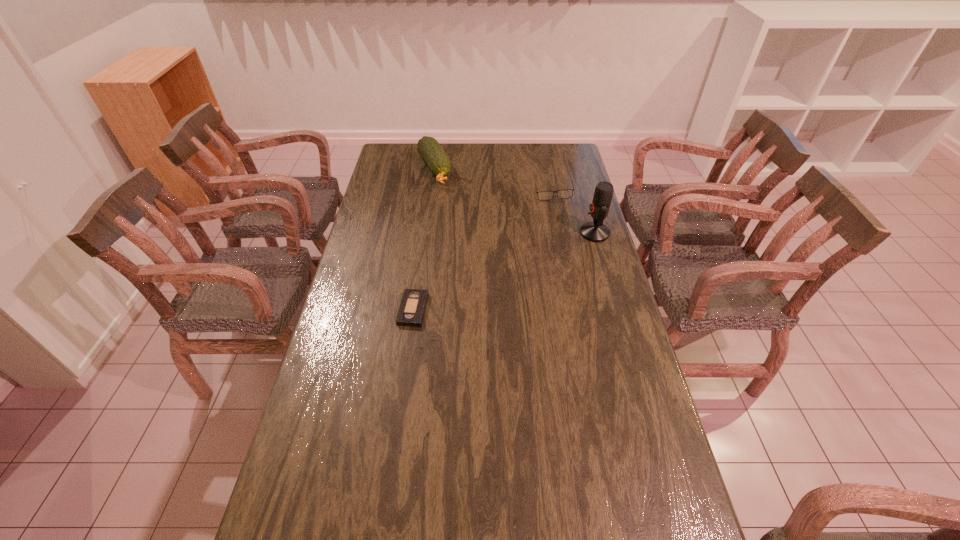
What are the coordinates of `vacant point that satisfies the following two spatial constraints: 1. on the back side of the videotape; 2. on the side of the microphone with the red ring` in the screenshot? It's located at (424, 233).

At what (x,y) coordinates should I click in order to perform the action: click on vacant space that satisfies the following two spatial constraints: 1. on the back side of the nearest object; 2. on the side of the third farthest object with the red ring. Please return your answer as a coordinate pair (x, y). This screenshot has height=540, width=960. Looking at the image, I should click on (424, 233).

Find the location of a particular element. free space that satisfies the following two spatial constraints: 1. on the front side of the third tallest object; 2. on the side of the tallest object with the red ring is located at coordinates (562, 233).